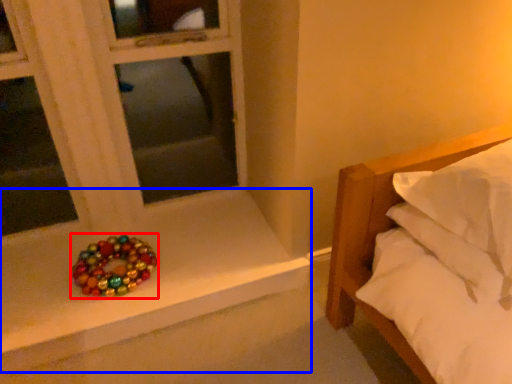
Question: Which point is closer to the camera, glass bead (highlighted by a red box) or window sill (highlighted by a blue box)?

Choices:
 (A) glass bead
 (B) window sill

Answer: (B)